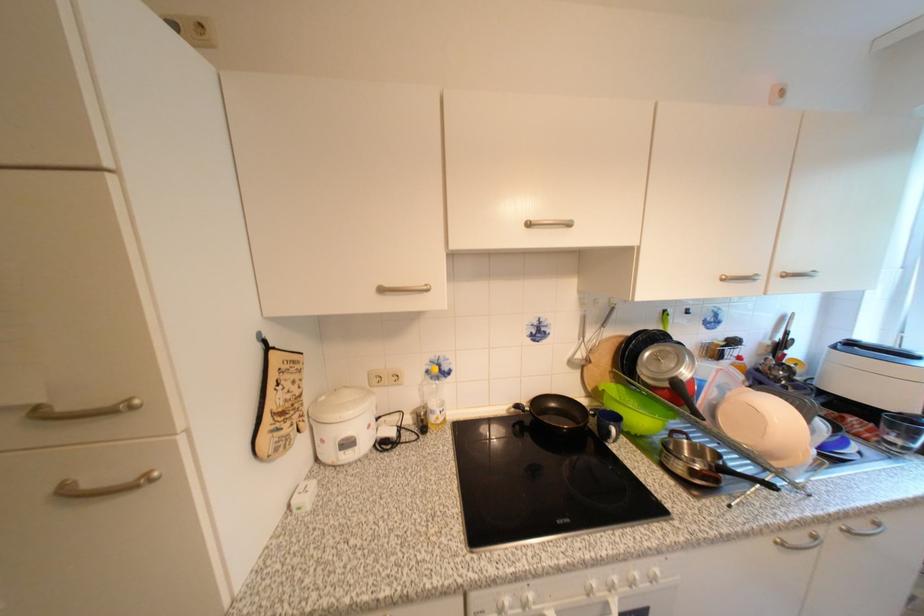
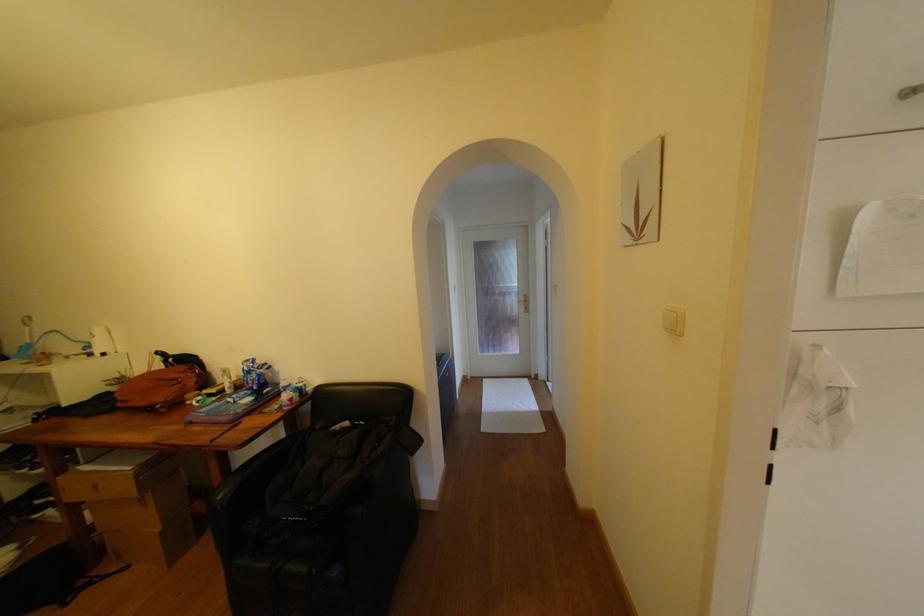
Question: Which direction would the cameraman need to move to produce the second image? Reply with the corresponding letter.

Choices:
 (A) Left
 (B) Right
 (C) Forward
 (D) Backward

Answer: (A)